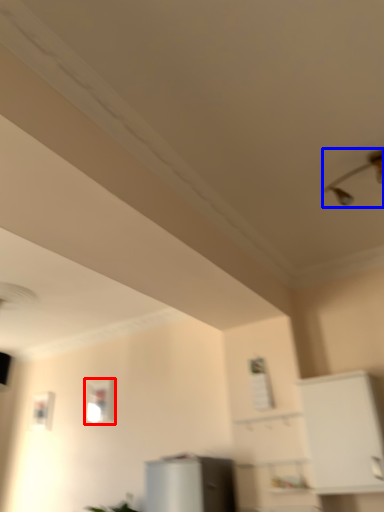
Question: Which object appears closest to the camera in this image, window (highlighted by a red box) or light fixture (highlighted by a blue box)?

Choices:
 (A) window
 (B) light fixture

Answer: (B)